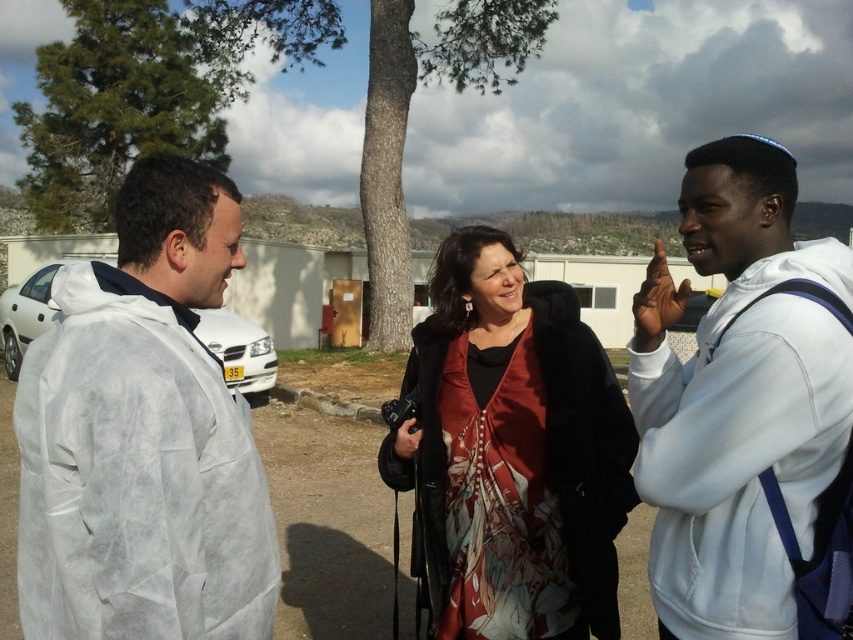
You are a delivery robot with a 4 feet wide package. You need to move from the white matte car at left to the white fleece jacket at right. Is there enough space between them for you to pass with the package?

The distance between the white fleece jacket at right and the white matte car at left is 20.51 feet, which is more than enough space for the delivery robot carrying a 4 feet wide package to pass safely.

You are standing in the parking area and want to walk from point (776, 164) to point (613, 419). Which direction should you move in relative to your current position?

Since point (776, 164) is closer to the viewer than point (613, 419), you should move away from the viewer to reach point (613, 419) from point (776, 164).